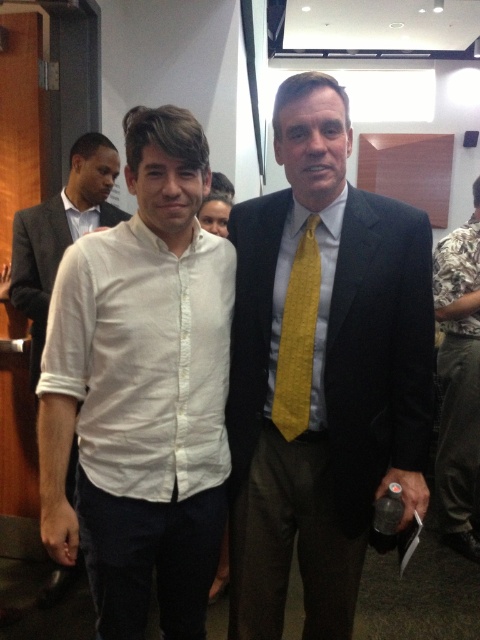
Based on the photo, between matte black suit at center and yellow woven tie at center, which one appears on the left side from the viewer's perspective?

yellow woven tie at center

Who is higher up, matte black suit at center or yellow woven tie at center?

yellow woven tie at center is above.

This screenshot has width=480, height=640. I want to click on matte black suit at center, so click(x=322, y=371).

I want to click on matte black suit at center, so click(322, 371).

Is point (456, 451) in front of point (73, 234)?

No, (456, 451) is behind (73, 234).

Who is more forward, [456,522] or [44,593]?

Point [44,593] is more forward.

Which is in front, point (451, 518) or point (58, 209)?

Point (58, 209) is in front.

Locate an element on the screen. This screenshot has width=480, height=640. camouflage fabric shirt at center is located at coordinates (458, 381).

Between white linen shirt at center and camouflage fabric shirt at center, which one is positioned higher?

camouflage fabric shirt at center is higher up.

What do you see at coordinates (142, 390) in the screenshot?
I see `white linen shirt at center` at bounding box center [142, 390].

Who is more distant from viewer, (195, 202) or (458, 547)?

Point (458, 547)

This screenshot has height=640, width=480. What are the coordinates of `white linen shirt at center` in the screenshot? It's located at (142, 390).